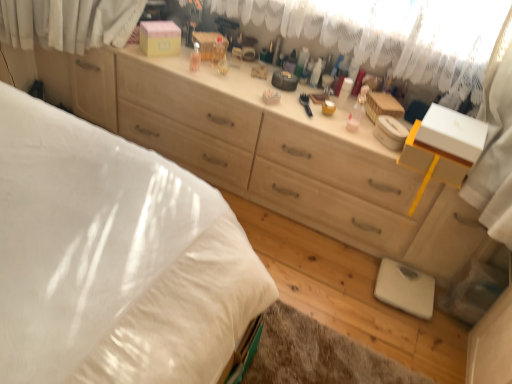
Locate an element on the screen. free point behind transparent plastic bottle at center, arranged as the 3th toiletry when viewed from the right is located at coordinates (199, 53).